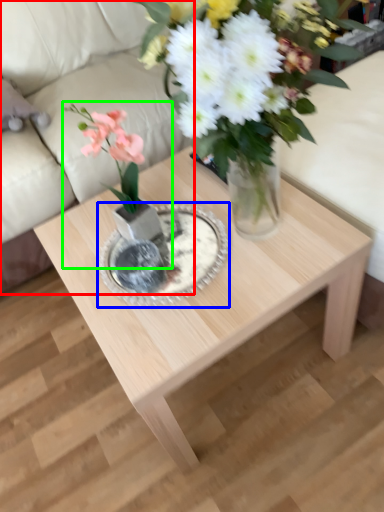
Question: Which object is the farthest from couch (highlighted by a red box)? Choose among these: glass plate (highlighted by a blue box) or houseplant (highlighted by a green box).

Choices:
 (A) glass plate
 (B) houseplant

Answer: (B)